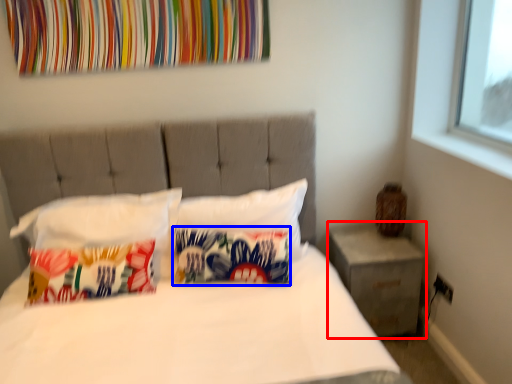
Question: Which point is further to the camera, nightstand (highlighted by a red box) or pillow (highlighted by a blue box)?

Choices:
 (A) nightstand
 (B) pillow

Answer: (A)